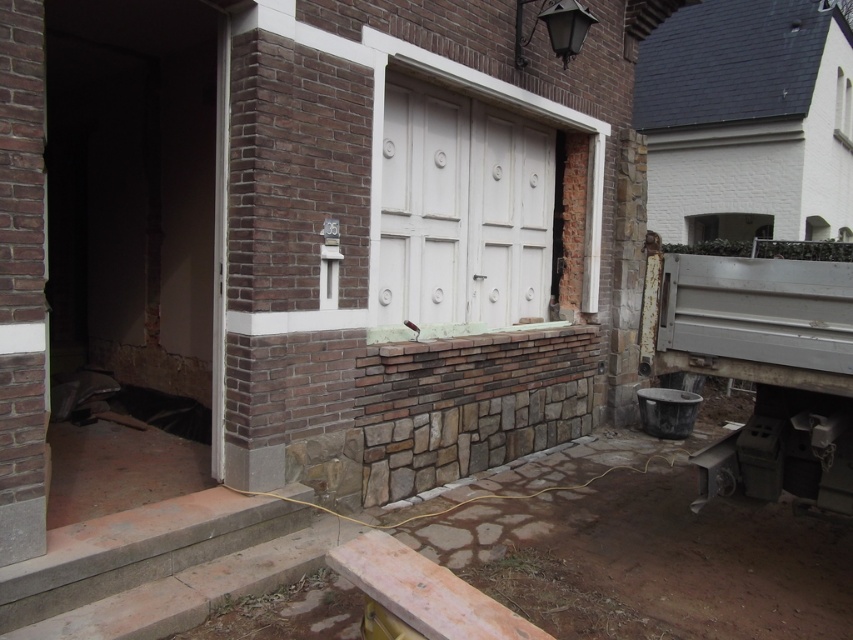
Question: Does white painted wood door at center have a smaller size compared to transparent glass window at upper right?

Choices:
 (A) yes
 (B) no

Answer: (B)

Question: Does white painted wood door at center appear under transparent glass window at upper right?

Choices:
 (A) yes
 (B) no

Answer: (A)

Question: Is white painted wood door at center below transparent glass window at upper right?

Choices:
 (A) yes
 (B) no

Answer: (A)

Question: Which object is closer to the camera taking this photo?

Choices:
 (A) transparent glass window at upper right
 (B) white painted wood door at center

Answer: (B)